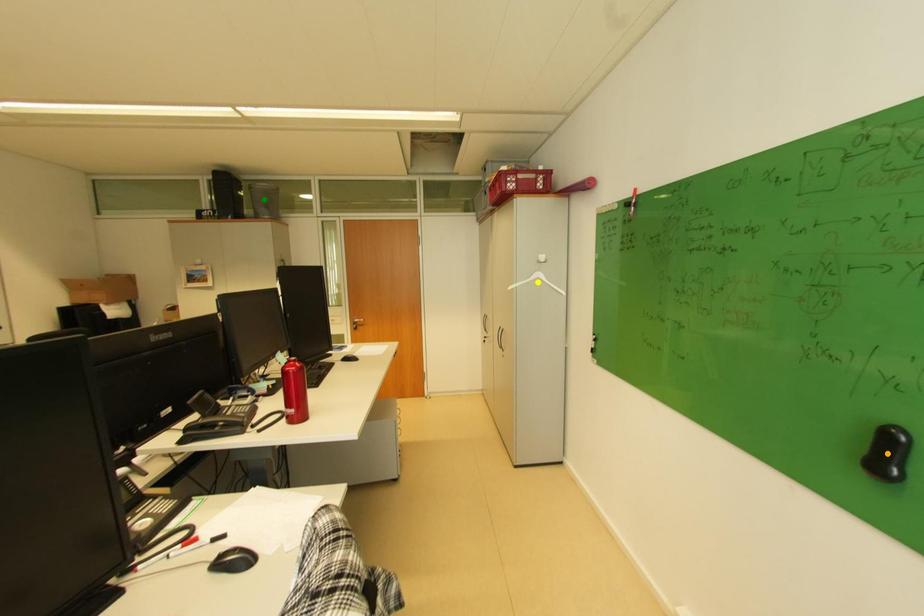
Order these from nearest to farthest:
orange point
yellow point
green point

orange point, yellow point, green point